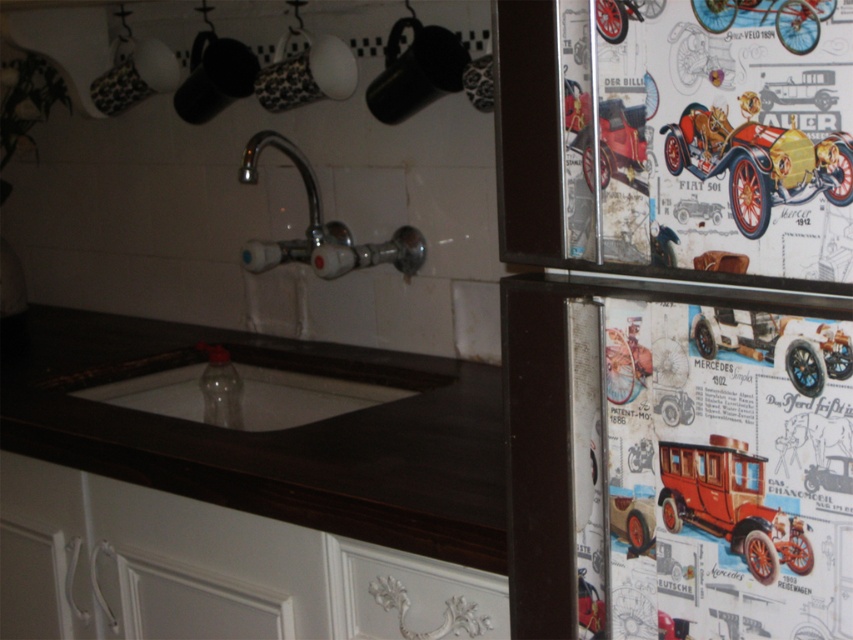
You are a kitchen designer checking the layout. You need to ensure that the metallic vintage car at upper right and the white glossy sink at center do not block each other. Based on their heights, which one is shorter and might need adjustment?

The metallic vintage car at upper right has a lesser height compared to the white glossy sink at center. Therefore, the metallic vintage car at upper right is shorter and might need adjustment to avoid blocking the sink.

You are standing in the kitchen and want to take a photo of the metallic vintage car at upper right. If your camera has a minimum focusing distance of 30 inches, will you need to step back to take a clear picture?

The metallic vintage car at upper right is 28.91 inches away from the camera. Since the minimum focusing distance is 30 inches, you need to step back to ensure the camera can focus properly.

You are standing in the kitchen facing the sink area. There are two points marked in the scene. Which point, point (x=769, y=141) or point (x=790, y=6), is closer to you?

Point (x=790, y=6) is closer to you because it is in front of point (x=769, y=141).